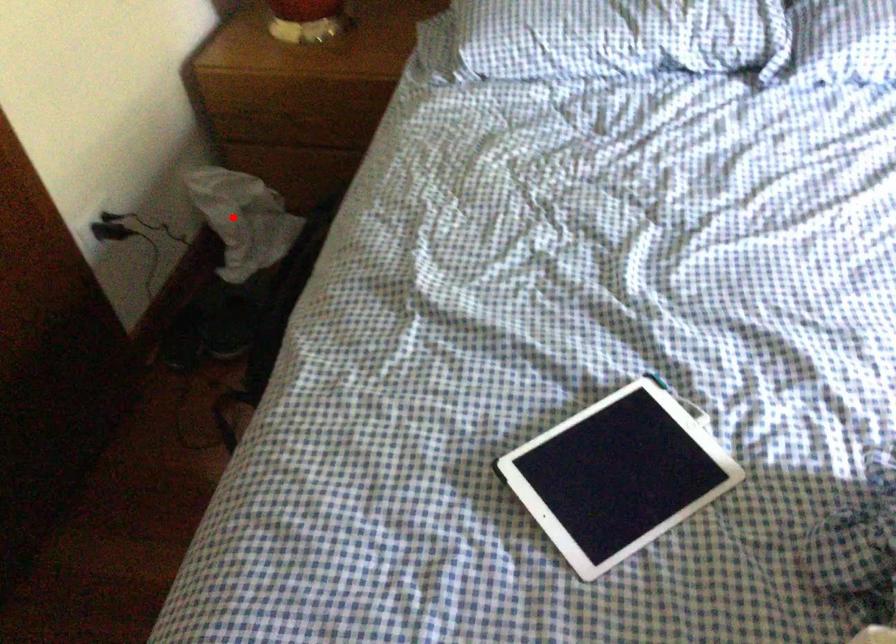
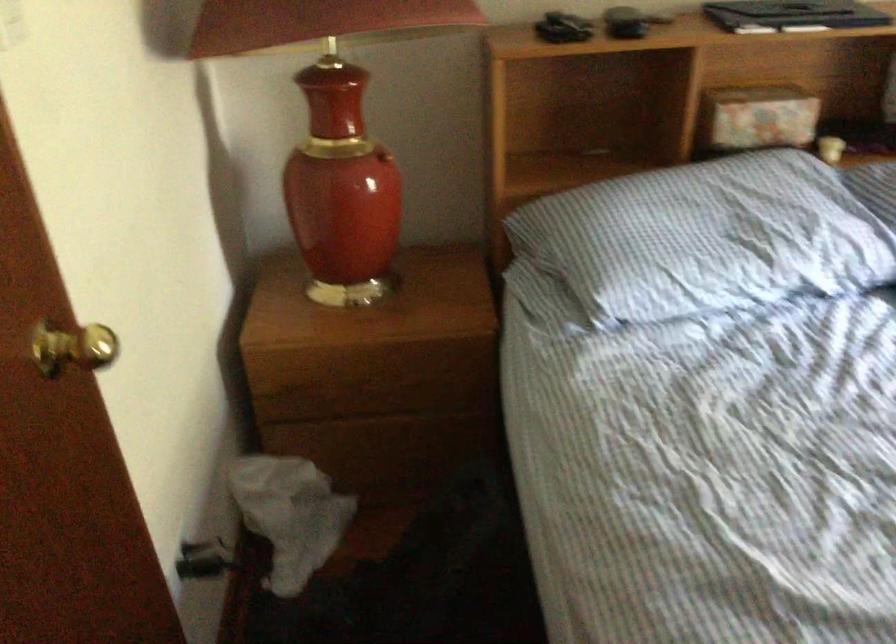
Find the pixel in the second image that matches the highlighted location in the first image.

(289, 515)